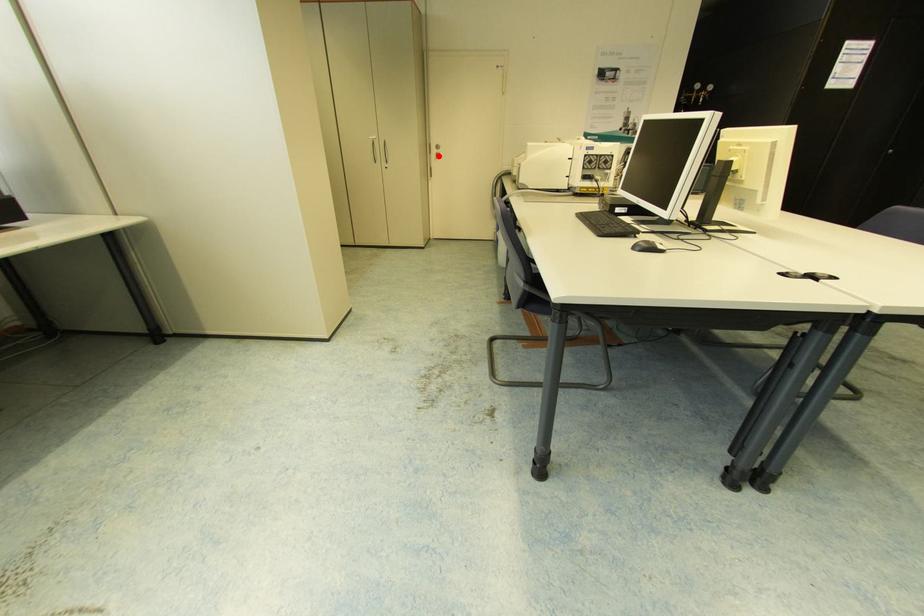
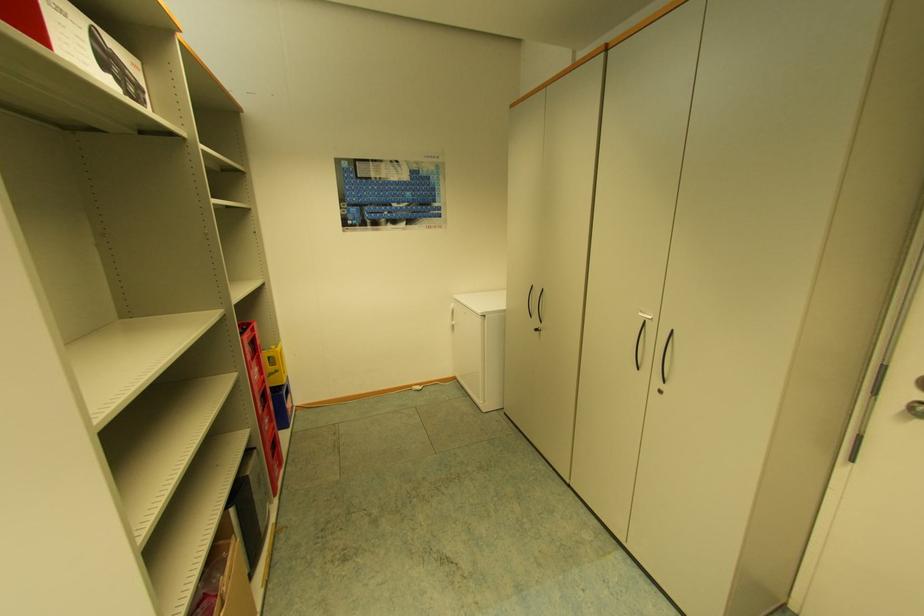
Question: A red point is marked in image1. In image2, is the corresponding 3D point closer to the camera or farther? Reply with the corresponding letter.

Choices:
 (A) The corresponding 3D point is closer.
 (B) The corresponding 3D point is farther.

Answer: (B)